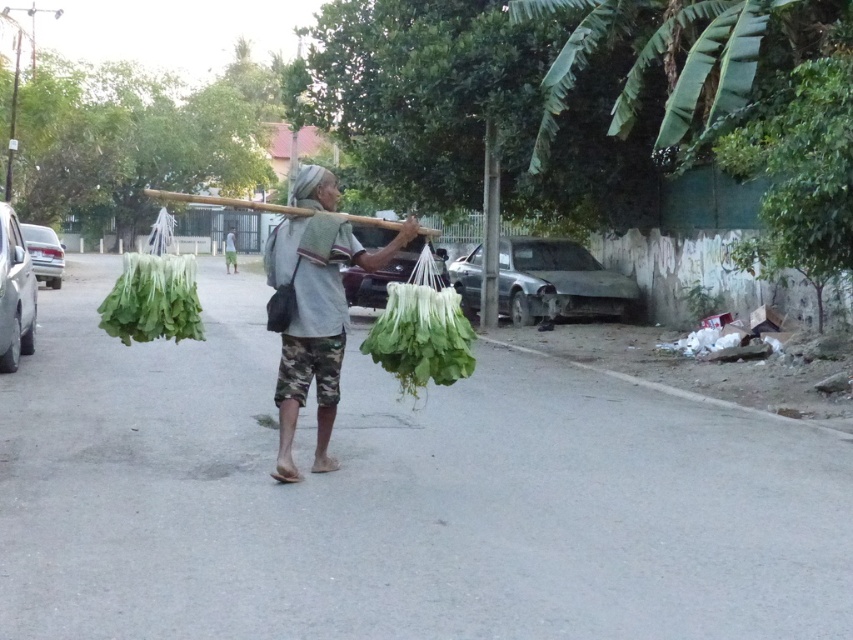
Question: Which object appears farthest from the camera in this image?

Choices:
 (A) gray fabric headscarf at center
 (B) green leafy vegetables at center
 (C) green leafy vegetable at center
 (D) green leafy at center

Answer: (A)

Question: From the image, what is the correct spatial relationship of green leafy vegetable at center in relation to gray fabric headscarf at center?

Choices:
 (A) above
 (B) below

Answer: (B)

Question: Which object appears closest to the camera in this image?

Choices:
 (A) green leafy at center
 (B) gray fabric headscarf at center
 (C) green leafy vegetables at center
 (D) green leafy vegetable at center

Answer: (A)

Question: Does green leafy vegetables at center appear on the right side of green leafy at center?

Choices:
 (A) yes
 (B) no

Answer: (B)

Question: Which point appears farthest from the camera in this image?

Choices:
 (A) (340, 342)
 (B) (335, 196)

Answer: (B)

Question: Is green leafy vegetables at center to the left of green leafy at center from the viewer's perspective?

Choices:
 (A) no
 (B) yes

Answer: (B)